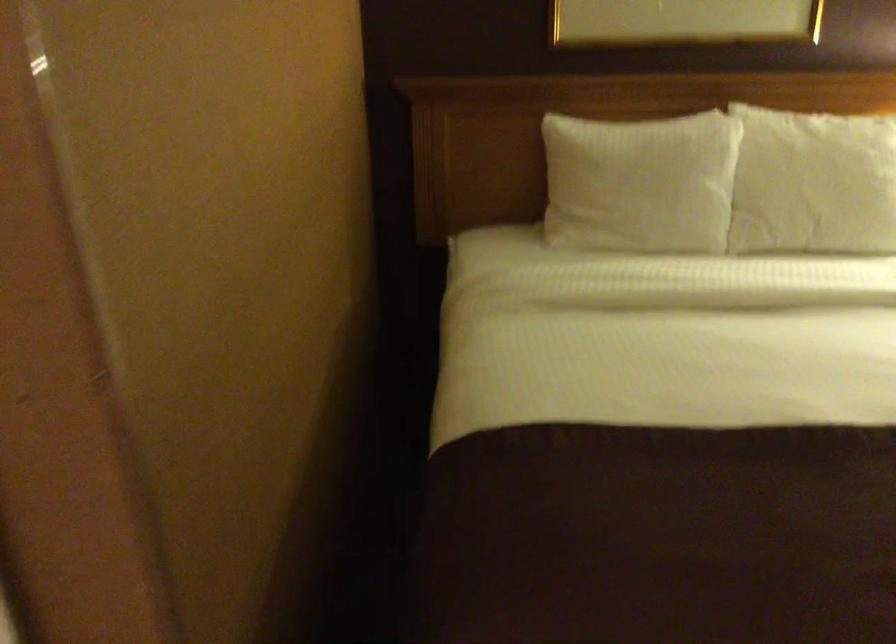
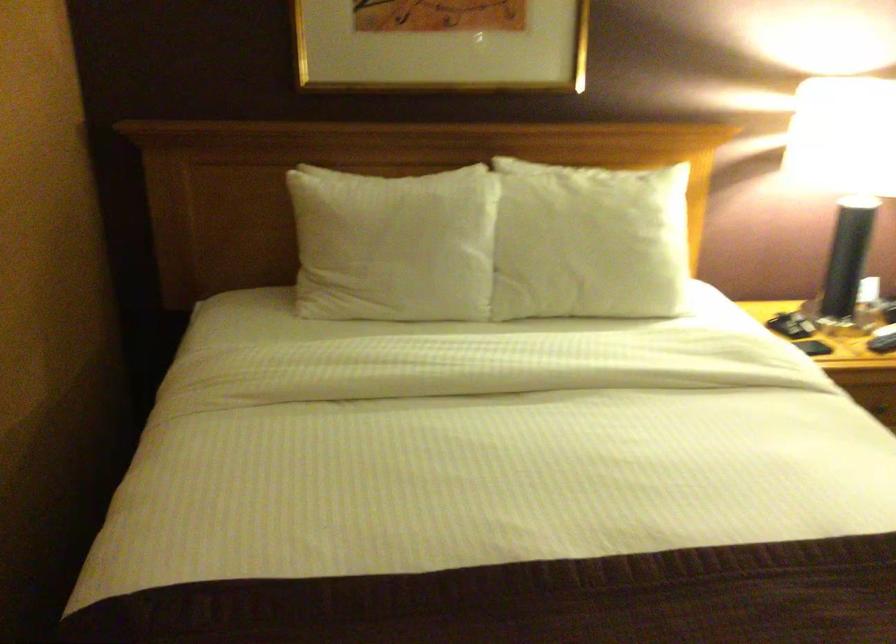
Question: How did the camera likely rotate?

Choices:
 (A) Left
 (B) Right
 (C) Up
 (D) Down

Answer: (B)